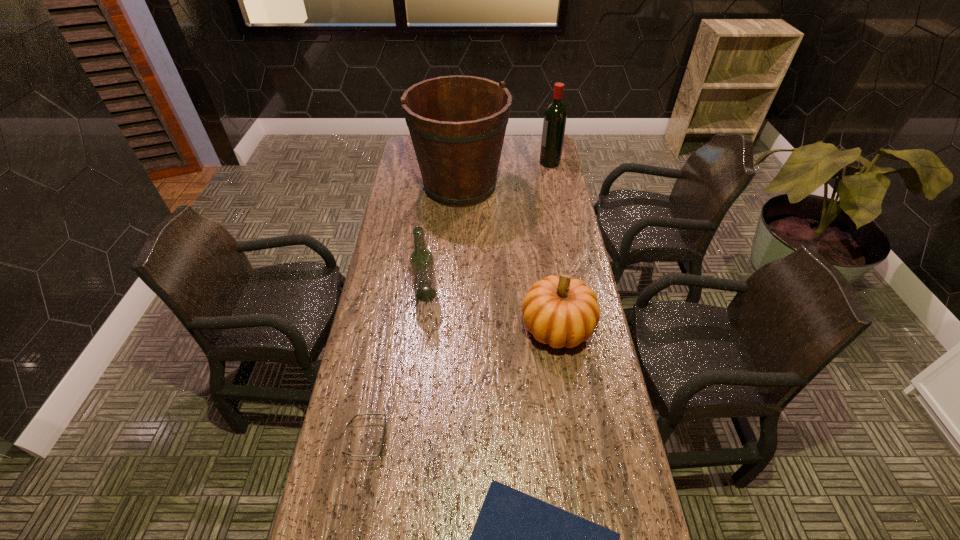
The width and height of the screenshot is (960, 540). I want to click on bucket, so click(457, 124).

Identify the location of wine bottle. (555, 116).

Find the location of `the third tallest object`. the third tallest object is located at coordinates (422, 264).

At what (x,y) coordinates should I click in order to perform the action: click on pumpkin. Please return your answer as a coordinate pair (x, y). This screenshot has width=960, height=540. Looking at the image, I should click on (560, 311).

Find the location of a particular element. Image resolution: width=960 pixels, height=540 pixels. sunglasses is located at coordinates (381, 448).

Identify the location of the second shortest object. (381, 448).

Find the location of a particular element. The image size is (960, 540). vacant space positioned 0.130m on the back of the bucket is located at coordinates (462, 147).

Where is `blank area located on the label of the wine bottle`? Image resolution: width=960 pixels, height=540 pixels. blank area located on the label of the wine bottle is located at coordinates (467, 163).

The height and width of the screenshot is (540, 960). In order to click on vacant space situated 0.050m on the label of the wine bottle in this screenshot , I will do `click(529, 163)`.

Identify the location of free space located 0.300m on the label of the wine bottle. The height and width of the screenshot is (540, 960). (475, 163).